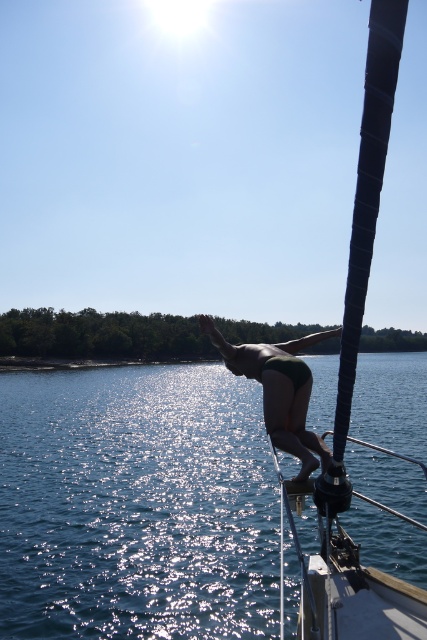
You are a photographer taking a picture of the shiny blue water at center and the green matte bikini at center. Which object appears taller in the photo?

The shiny blue water at center appears taller than the green matte bikini at center in the photo.

You are a photographer trying to capture the perfect shot of the diver. You need to position your camera so that the green matte bikini at center is centered in the frame. Where should you place the shiny blue water at center relative to the bikini?

The shiny blue water at center should be placed to the right of the green matte bikini at center.

You are a photographer trying to capture the perfect shot of the diver. Based on the scene, which object is closer to the camera when focusing on the shiny blue water at center and the green matte bikini at center?

The shiny blue water at center is closer to the camera since it is in front of the green matte bikini at center.